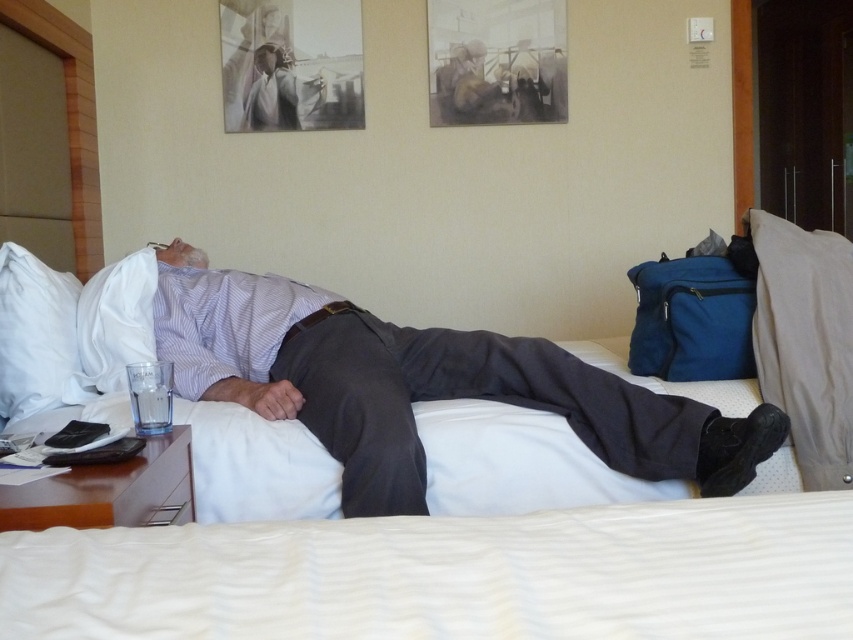
Question: Which object is positioned farthest from the white soft pillow at left?

Choices:
 (A) matte purple shirt at center
 (B) white fabric bed at center
 (C) white soft pillow at upper left

Answer: (B)

Question: From the image, what is the correct spatial relationship of white fabric bed at center in relation to matte purple shirt at center?

Choices:
 (A) right
 (B) left

Answer: (A)

Question: Can you confirm if matte purple shirt at center is positioned below white soft pillow at upper left?

Choices:
 (A) yes
 (B) no

Answer: (A)

Question: Which is farther from the white soft pillow at upper left?

Choices:
 (A) white soft pillow at left
 (B) matte purple shirt at center

Answer: (B)

Question: Which point appears closest to the camera in this image?

Choices:
 (A) (801, 566)
 (B) (53, 342)
 (C) (419, 381)

Answer: (A)

Question: Does white soft pillow at left have a greater width compared to white soft pillow at upper left?

Choices:
 (A) no
 (B) yes

Answer: (A)